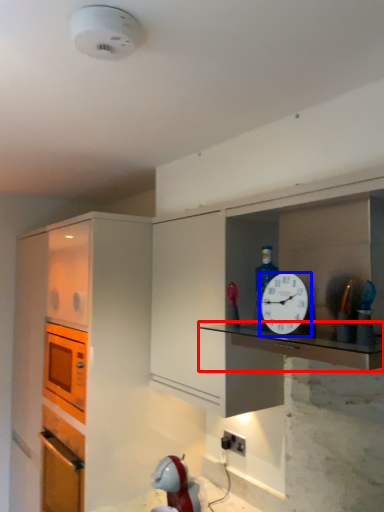
Question: Which object appears closest to the camera in this image, counter top (highlighted by a red box) or clock (highlighted by a blue box)?

Choices:
 (A) counter top
 (B) clock

Answer: (A)